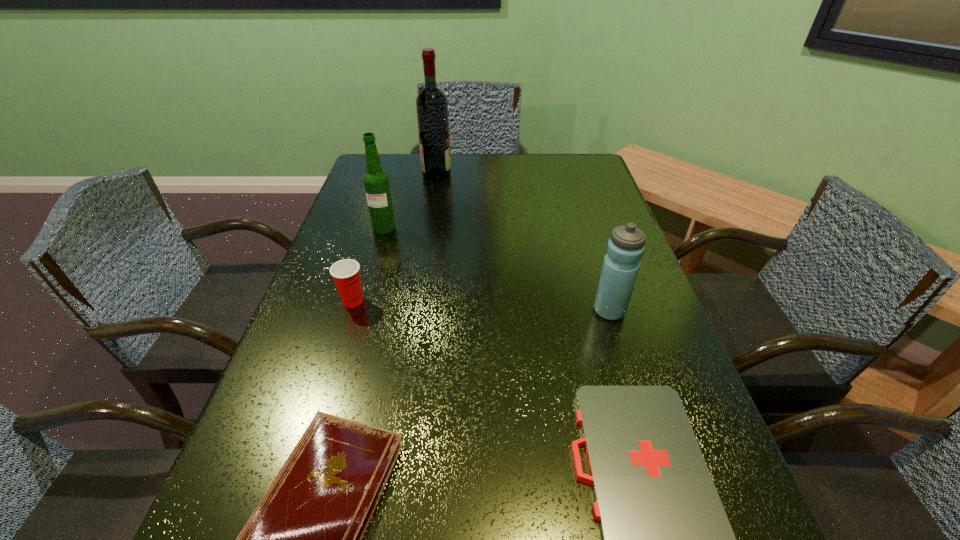
Find the location of a particular element. empty location between the farthest object and the beer bottle is located at coordinates (410, 201).

You are a GUI agent. You are given a task and a screenshot of the screen. Output one action in this format:
    pyautogui.click(x=<x>, y=<y>)
    Task: Click on the vacant space in between the alcohol and the water bottle
    The image size is (960, 540).
    Given the screenshot: What is the action you would take?
    pyautogui.click(x=523, y=243)

Find the location of a particular element. Image resolution: width=960 pixels, height=540 pixels. object that can be found as the second closest to the beer bottle is located at coordinates [346, 273].

You are a GUI agent. You are given a task and a screenshot of the screen. Output one action in this format:
    pyautogui.click(x=<x>, y=<y>)
    Task: Click on the third closest object to the tallest object
    The height and width of the screenshot is (540, 960).
    Given the screenshot: What is the action you would take?
    pyautogui.click(x=625, y=248)

I want to click on vacant area in the image that satisfies the following two spatial constraints: 1. on the front and back of the farthest object; 2. on the label of the beer bottle, so click(x=429, y=227).

Where is `vacant space that satisfies the following two spatial constraints: 1. on the front and back of the fourth shortest object; 2. on the right side of the alcohol`? The width and height of the screenshot is (960, 540). vacant space that satisfies the following two spatial constraints: 1. on the front and back of the fourth shortest object; 2. on the right side of the alcohol is located at coordinates (416, 310).

Where is `free space in the image that satisfies the following two spatial constraints: 1. on the front and back of the tallest object; 2. on the label of the fifth nearest object`? The height and width of the screenshot is (540, 960). free space in the image that satisfies the following two spatial constraints: 1. on the front and back of the tallest object; 2. on the label of the fifth nearest object is located at coordinates (429, 227).